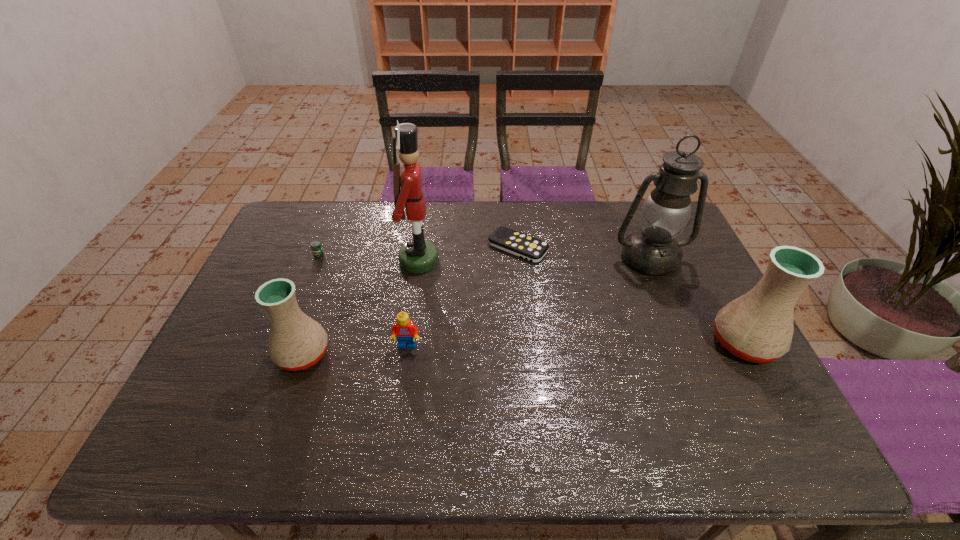
This screenshot has width=960, height=540. What are the coordinates of `free location that satisfies the following two spatial constraints: 1. on the front-facing side of the taller pottery; 2. on the left side of the nutcracker` in the screenshot? It's located at (407, 342).